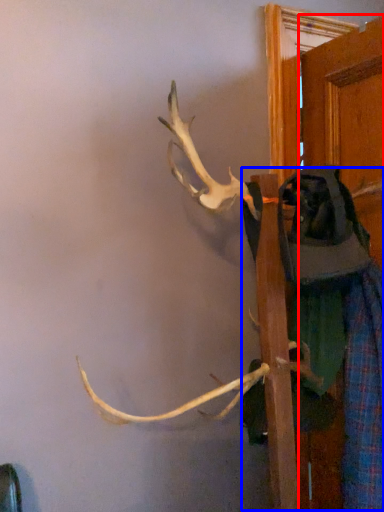
Question: Among these objects, which one is farthest to the camera, door (highlighted by a red box) or clothing (highlighted by a blue box)?

Choices:
 (A) door
 (B) clothing

Answer: (A)